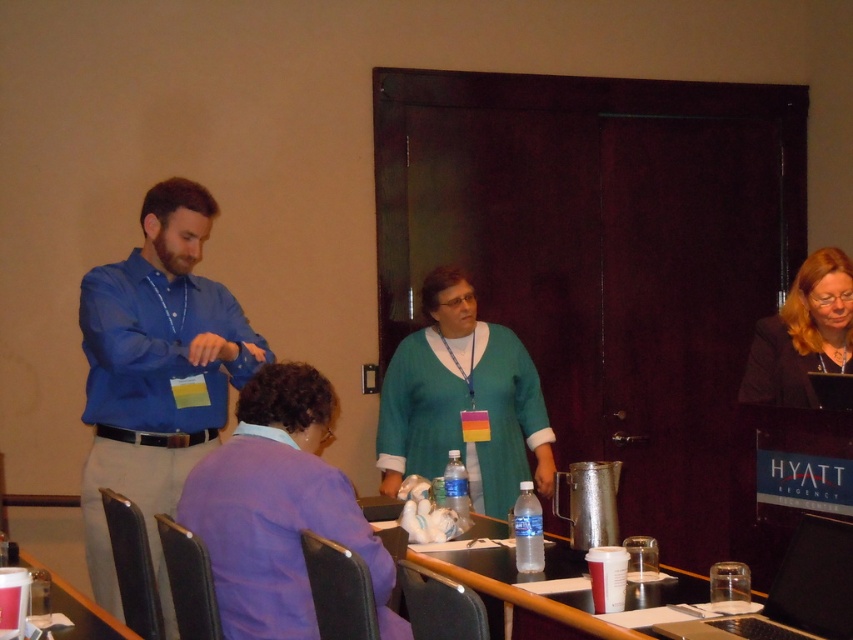
Question: Which of these objects is positioned closest to the smooth plastic table at lower left?

Choices:
 (A) purple matte shirt at lower left
 (B) metallic silver laptop at center

Answer: (A)

Question: Does teal sweater at center appear under smooth plastic table at lower left?

Choices:
 (A) no
 (B) yes

Answer: (A)

Question: Which object is positioned farthest from the teal sweater at center?

Choices:
 (A) purple matte shirt at lower left
 (B) black plastic laptop at lower right

Answer: (B)

Question: Which of these objects is positioned closest to the black plastic laptop at lower right?

Choices:
 (A) matte black jacket at upper right
 (B) blue shirt at left

Answer: (A)

Question: From the image, what is the correct spatial relationship of metallic silver laptop at center in relation to black plastic laptop at lower right?

Choices:
 (A) below
 (B) above

Answer: (A)

Question: Is purple matte shirt at lower left bigger than metallic silver laptop at center?

Choices:
 (A) yes
 (B) no

Answer: (B)